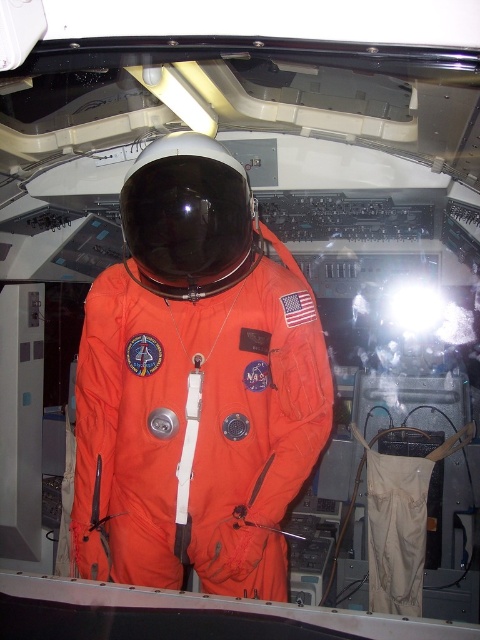
Question: Which point appears farthest from the camera in this image?

Choices:
 (A) (167, 310)
 (B) (128, 193)

Answer: (A)

Question: Does orange fabric astronaut at center appear under black matte helmet at center?

Choices:
 (A) yes
 (B) no

Answer: (A)

Question: Is orange fabric astronaut at center smaller than black matte helmet at center?

Choices:
 (A) yes
 (B) no

Answer: (B)

Question: Can you confirm if orange fabric astronaut at center is bigger than black matte helmet at center?

Choices:
 (A) no
 (B) yes

Answer: (B)